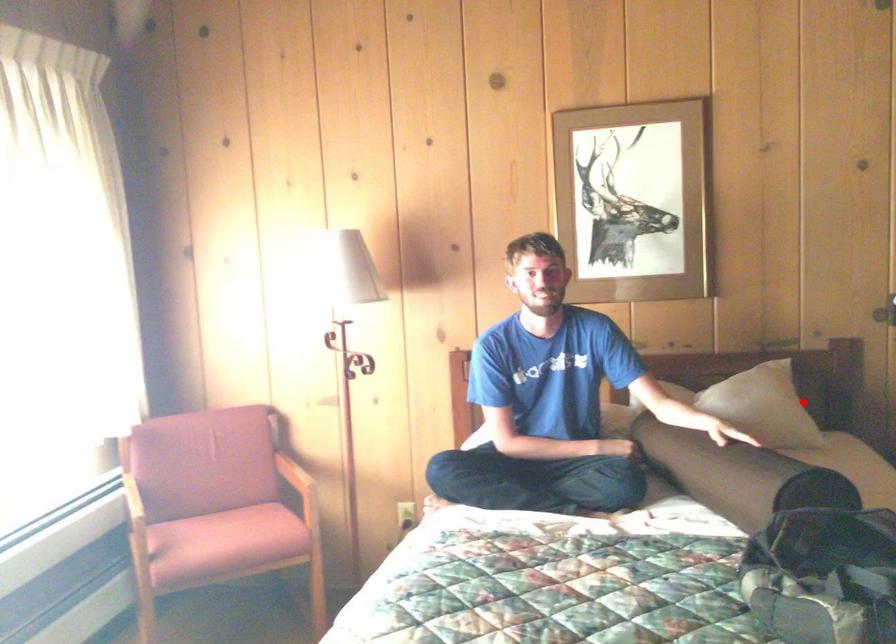
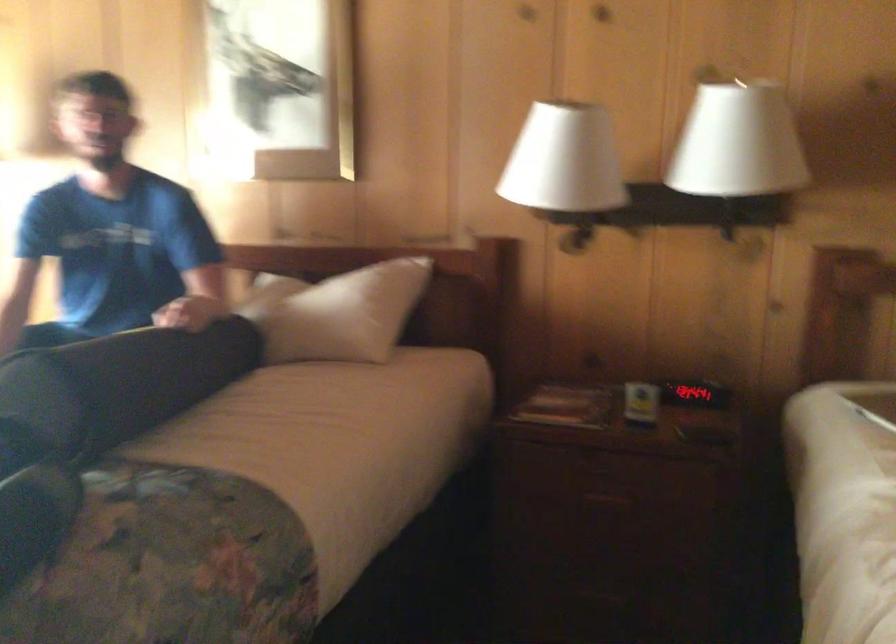
Question: A red point is marked in image1. In image2, is the corresponding 3D point closer to the camera or farther? Reply with the corresponding letter.

Choices:
 (A) The corresponding 3D point is closer.
 (B) The corresponding 3D point is farther.

Answer: (A)